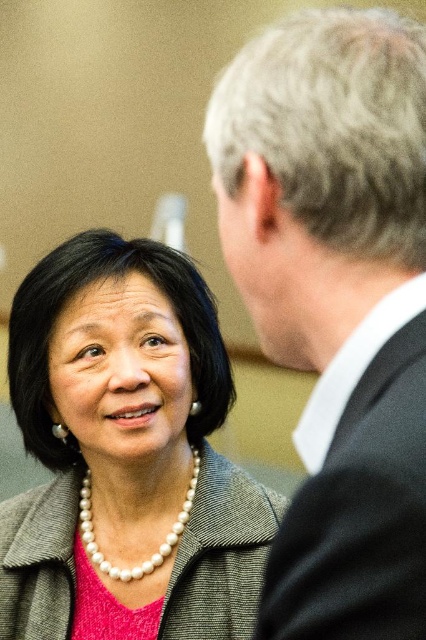
Is black wool suit at upper right behind gray textured jacket at center?

No, it is not.

Does black wool suit at upper right have a lesser height compared to gray textured jacket at center?

Yes.

The image size is (426, 640). Describe the element at coordinates (359, 490) in the screenshot. I see `black wool suit at upper right` at that location.

This screenshot has width=426, height=640. Find the location of `black wool suit at upper right`. black wool suit at upper right is located at coordinates (359, 490).

Who is more forward, (x=293, y=516) or (x=379, y=561)?

Positioned in front is point (x=379, y=561).

Who is more distant from viewer, [359,184] or [337,481]?

Point [359,184]

What do you see at coordinates (336, 301) in the screenshot? I see `smooth gray suit at right` at bounding box center [336, 301].

What are the coordinates of `smooth gray suit at right` in the screenshot? It's located at (336, 301).

Is smooth gray suit at right taller than gray textured jacket at center?

Yes, smooth gray suit at right is taller than gray textured jacket at center.

Consider the image. Can you confirm if smooth gray suit at right is positioned to the right of gray textured jacket at center?

Yes, smooth gray suit at right is to the right of gray textured jacket at center.

Where is `smooth gray suit at right`? Image resolution: width=426 pixels, height=640 pixels. smooth gray suit at right is located at coordinates (336, 301).

Identify the location of smooth gray suit at right. Image resolution: width=426 pixels, height=640 pixels. (336, 301).